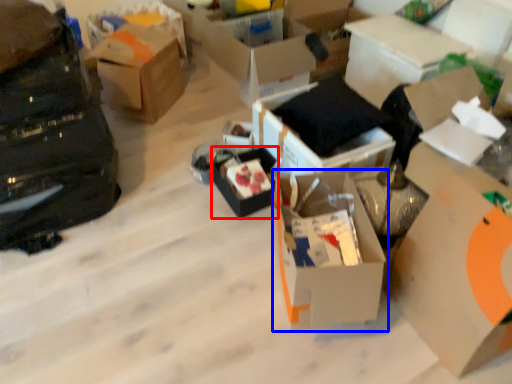
Question: Which object appears closest to the camera in this image, box (highlighted by a red box) or box (highlighted by a blue box)?

Choices:
 (A) box
 (B) box

Answer: (B)